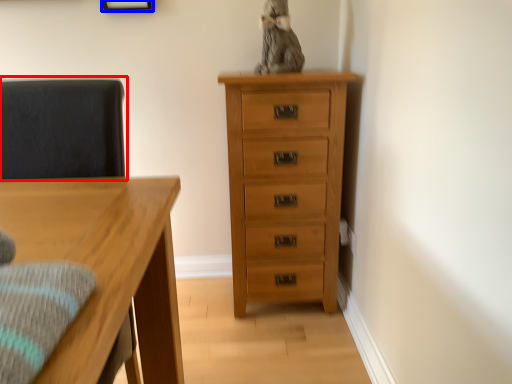
Question: Which object appears farthest to the camera in this image, swivel chair (highlighted by a red box) or picture frame (highlighted by a blue box)?

Choices:
 (A) swivel chair
 (B) picture frame

Answer: (B)